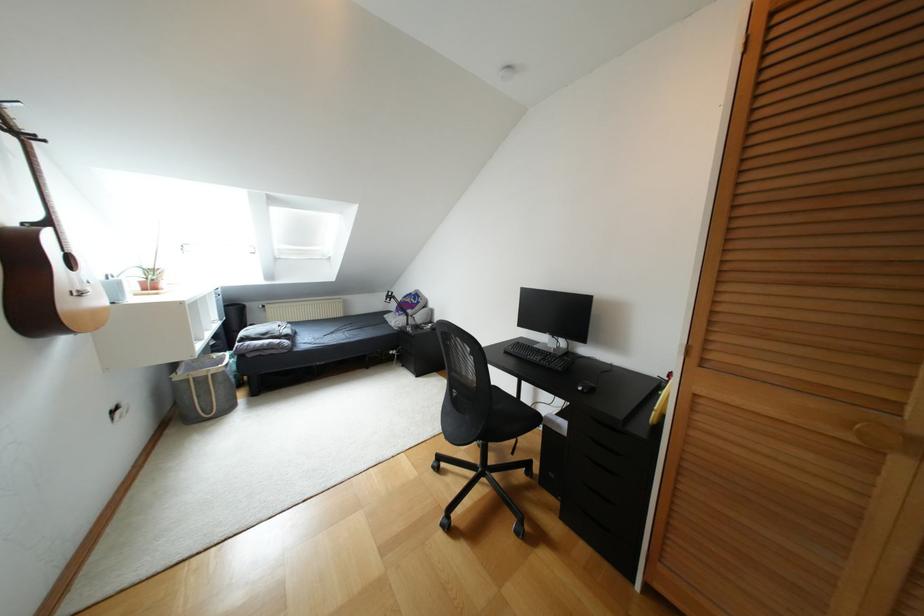
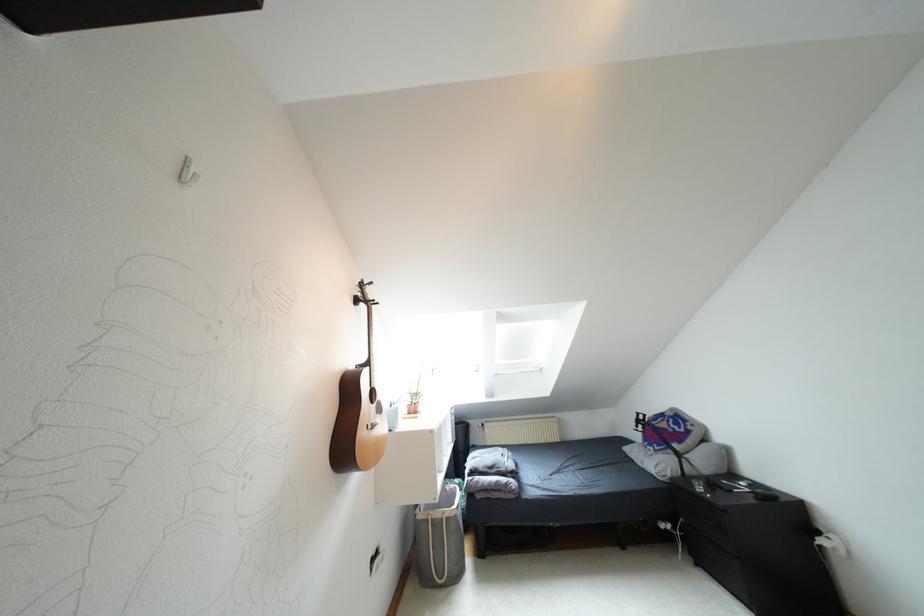
The first image is from the beginning of the video and the second image is from the end. How did the camera likely rotate when shooting the video?

The camera rotated toward left-up.